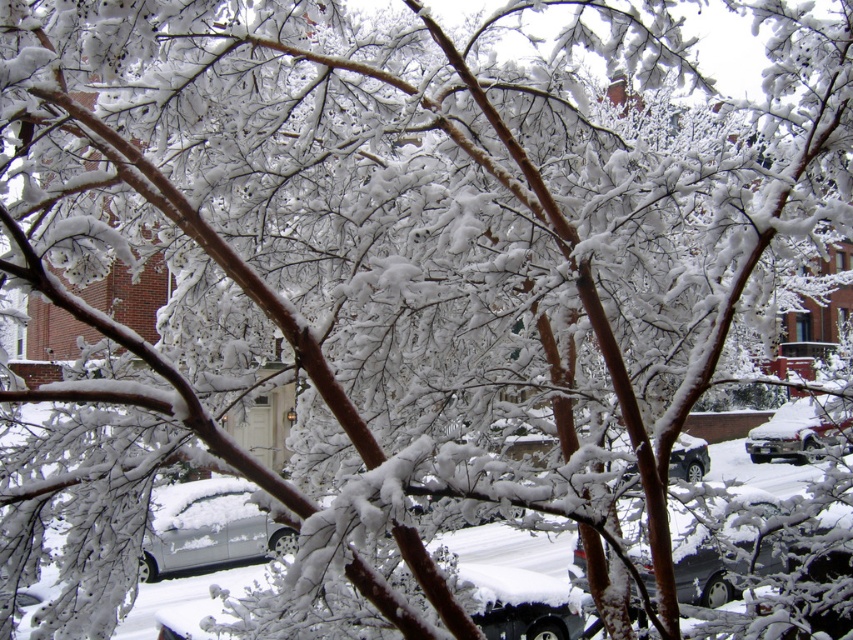
Image resolution: width=853 pixels, height=640 pixels. Find the location of `silver metallic suv at lower right`. silver metallic suv at lower right is located at coordinates (801, 429).

Can you confirm if silver metallic suv at lower right is positioned to the right of black matte suv at center?

Correct, you'll find silver metallic suv at lower right to the right of black matte suv at center.

What do you see at coordinates (801, 429) in the screenshot? The width and height of the screenshot is (853, 640). I see `silver metallic suv at lower right` at bounding box center [801, 429].

Identify the location of silver metallic suv at lower right. This screenshot has height=640, width=853. (801, 429).

Between silver metallic car at lower left and silver metallic suv at lower right, which one is positioned higher?

silver metallic suv at lower right is higher up.

Can you confirm if silver metallic car at lower left is thinner than silver metallic suv at lower right?

Correct, silver metallic car at lower left's width is less than silver metallic suv at lower right's.

Which is in front, point (190, 554) or point (764, 452)?

Positioned in front is point (190, 554).

Where is `silver metallic car at lower left`? This screenshot has height=640, width=853. silver metallic car at lower left is located at coordinates (209, 528).

From the picture: Can you confirm if silver metallic car at lower left is positioned below black matte suv at center?

Yes, silver metallic car at lower left is below black matte suv at center.

Can you confirm if silver metallic car at lower left is thinner than black matte suv at center?

Yes.

The width and height of the screenshot is (853, 640). I want to click on silver metallic car at lower left, so click(x=209, y=528).